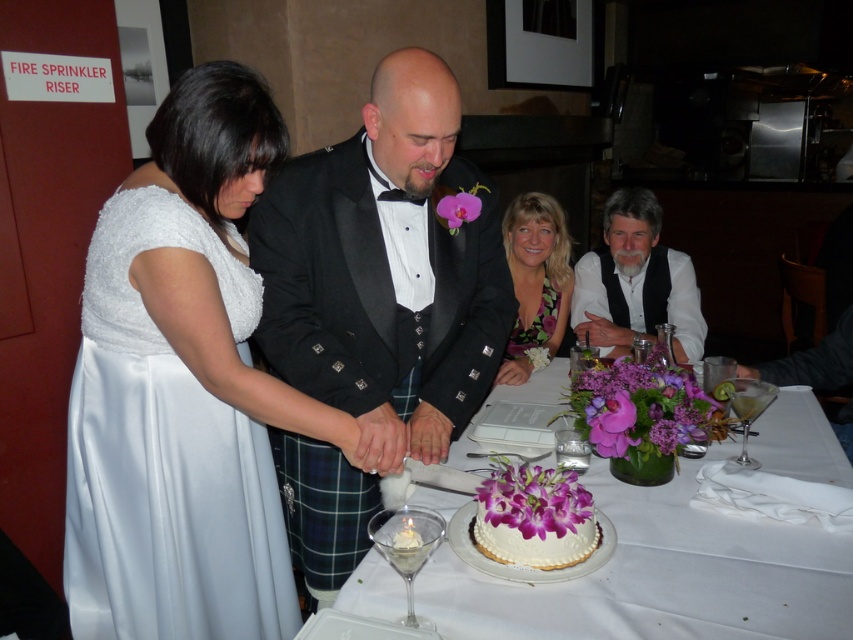
Between white textured cake at center and floral print fabric dress at center, which one is positioned lower?

white textured cake at center

Who is taller, white textured cake at center or floral print fabric dress at center?

floral print fabric dress at center

What do you see at coordinates (534, 516) in the screenshot?
I see `white textured cake at center` at bounding box center [534, 516].

Where is `white textured cake at center`? The width and height of the screenshot is (853, 640). white textured cake at center is located at coordinates (534, 516).

Is point (433, 246) positioned in front of point (108, 481)?

That is False.

Does black satin tuxedo at center have a smaller size compared to satin white dress at left?

Incorrect, black satin tuxedo at center is not smaller in size than satin white dress at left.

Is point (289, 285) behind point (184, 387)?

Yes.

The image size is (853, 640). In order to click on black satin tuxedo at center in this screenshot , I will do `click(376, 305)`.

Which of these two, satin white dress at left or purple floral dress at upper center, stands taller?

satin white dress at left is taller.

Based on the photo, is satin white dress at left positioned before purple floral dress at upper center?

Yes, it is in front of purple floral dress at upper center.

Which is in front, point (254, 630) or point (537, 195)?

Point (254, 630) is in front.

You are a GUI agent. You are given a task and a screenshot of the screen. Output one action in this format:
    pyautogui.click(x=<x>, y=<y>)
    Task: Click on the satin white dress at left
    
    Given the screenshot: What is the action you would take?
    pos(166,456)